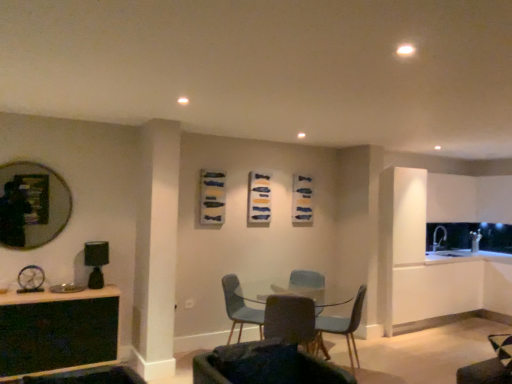
Question: Which direction should I rotate to look at matte blue chair at center, which ranks as the first chair in back-to-front order?

Choices:
 (A) right
 (B) left

Answer: (B)

Question: In which direction should I rotate to look at dark gray fabric chair at center, which is counted as the 4th chair, starting from the back?

Choices:
 (A) right
 (B) left

Answer: (A)

Question: Is black glass table at lower left positioned behind matte gray chair at center, the 2th chair from the front?

Choices:
 (A) yes
 (B) no

Answer: (B)

Question: Is black glass table at lower left positioned far away from matte gray chair at center, which is the third chair from back to front?

Choices:
 (A) yes
 (B) no

Answer: (A)

Question: Is black glass table at lower left directly adjacent to matte gray chair at center, the 2th chair from the front?

Choices:
 (A) yes
 (B) no

Answer: (B)

Question: Is black glass table at lower left oriented away from matte gray chair at center, the 2th chair from the front?

Choices:
 (A) no
 (B) yes

Answer: (A)

Question: Is black glass table at lower left taller than matte gray chair at center, the 2th chair from the front?

Choices:
 (A) no
 (B) yes

Answer: (B)

Question: Is matte gray chair at center, the 2th chair from the front, surrounded by black glass table at lower left?

Choices:
 (A) no
 (B) yes

Answer: (A)

Question: Considering the relative sizes of dark gray fabric chair at center, which is counted as the 4th chair, starting from the back, and matte blue chair at center, which ranks as the third chair in front-to-back order, in the image provided, is dark gray fabric chair at center, which is counted as the 4th chair, starting from the back, thinner than matte blue chair at center, which ranks as the third chair in front-to-back order,?

Choices:
 (A) yes
 (B) no

Answer: (B)

Question: Would you say matte blue chair at center, which ranks as the third chair in front-to-back order, is part of dark gray fabric chair at center, which ranks as the first chair in front-to-back order,'s contents?

Choices:
 (A) no
 (B) yes

Answer: (A)

Question: From the image's perspective, is dark gray fabric chair at center, which ranks as the first chair in front-to-back order, under matte blue chair at center, the 2th chair when ordered from back to front?

Choices:
 (A) yes
 (B) no

Answer: (B)

Question: Can you confirm if dark gray fabric chair at center, which is counted as the 4th chair, starting from the back, is bigger than matte blue chair at center, which ranks as the third chair in front-to-back order?

Choices:
 (A) yes
 (B) no

Answer: (B)

Question: From the image's perspective, is dark gray fabric chair at center, which is counted as the 4th chair, starting from the back, above matte blue chair at center, which ranks as the third chair in front-to-back order?

Choices:
 (A) yes
 (B) no

Answer: (A)

Question: Can you confirm if dark gray fabric chair at center, which is counted as the 4th chair, starting from the back, is positioned to the right of matte blue chair at center, which ranks as the third chair in front-to-back order?

Choices:
 (A) yes
 (B) no

Answer: (B)

Question: Does matte gray chair at center, the 2th chair from the front, contain dark gray fabric chair at center, which is counted as the 4th chair, starting from the back?

Choices:
 (A) yes
 (B) no

Answer: (B)